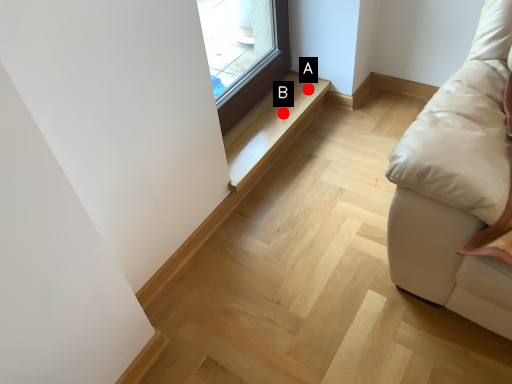
Question: Two points are circled on the image, labeled by A and B beside each circle. Which point appears closest to the camera in this image?

Choices:
 (A) A is closer
 (B) B is closer

Answer: (B)